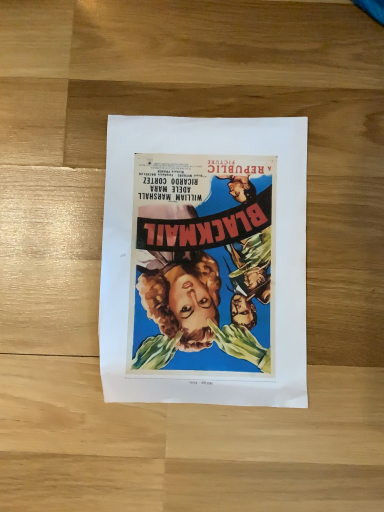
Locate an element on the screen. free location above matte paper poster at center (from a real-world perspective) is located at coordinates (200, 258).